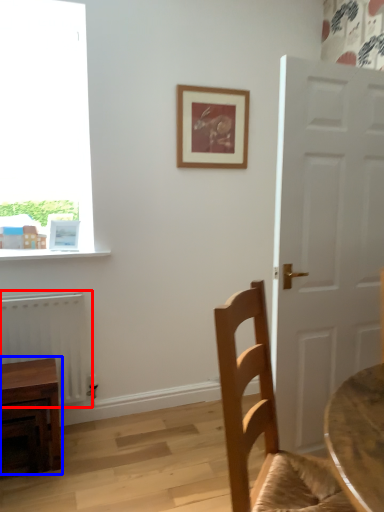
Question: Which of the following is the closest to the observer, radiator (highlighted by a red box) or table (highlighted by a blue box)?

Choices:
 (A) radiator
 (B) table

Answer: (B)